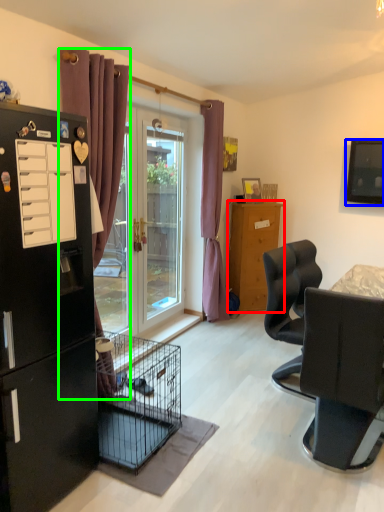
Question: Which is farther away from refrigerator (highlighted by a red box)? television (highlighted by a blue box) or curtain (highlighted by a green box)?

Choices:
 (A) television
 (B) curtain

Answer: (B)